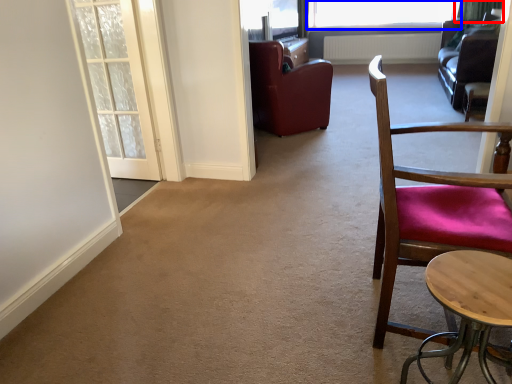
Question: Which object is further to the camera taking this photo, curtain (highlighted by a red box) or window (highlighted by a blue box)?

Choices:
 (A) curtain
 (B) window

Answer: (B)